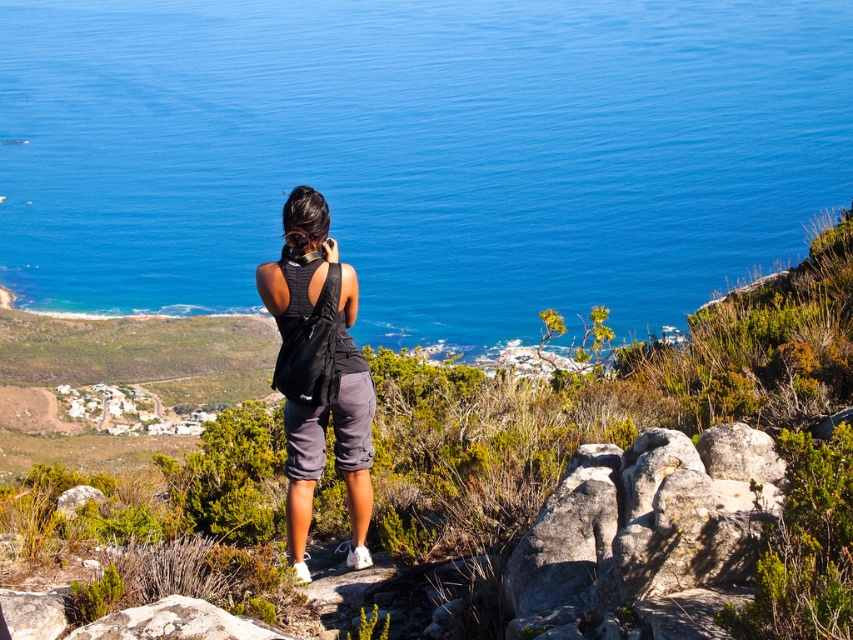
You are a hiker who has just reached the cliff edge. You want to take a photo of the blue water at center while keeping your black fabric backpack at center visible in the frame. Which direction should you aim your camera to include both?

To include both the blue water at center and the black fabric backpack at center in the frame, aim your camera to the right since the blue water at center is located to the right of the black fabric backpack at center.

You are a hiker who wants to take a photo of the blue water at center and the black fabric backpack at center. Which object should you focus on first if you want to capture both in one frame without moving your camera?

The blue water at center is wider than the black fabric backpack at center, so you should focus on the blue water at center first to ensure it fits within the frame.